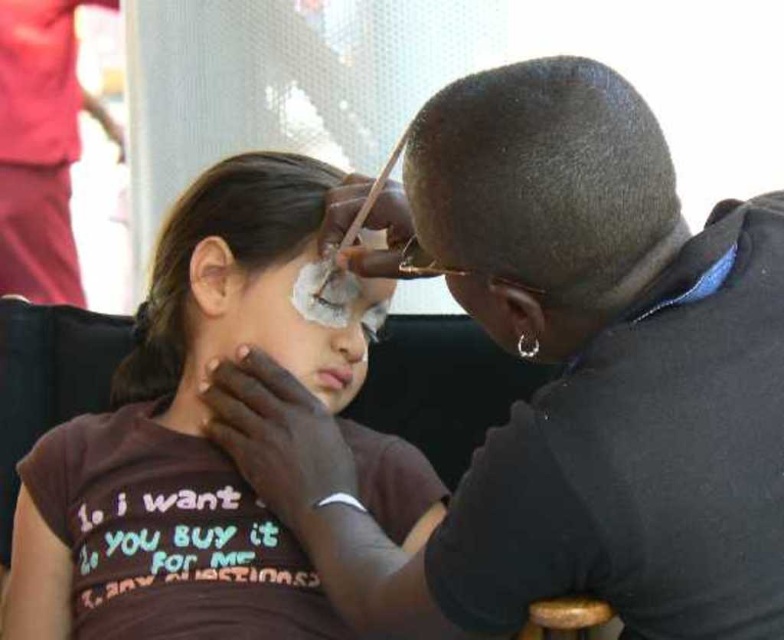
Question: Can you confirm if smooth skin face paint at upper center is positioned below matte black face at upper center?

Choices:
 (A) yes
 (B) no

Answer: (A)

Question: Does matte brown shirt at center have a larger size compared to white matte face paint at center?

Choices:
 (A) no
 (B) yes

Answer: (B)

Question: Which object is farther from the camera taking this photo?

Choices:
 (A) smooth skin face paint at upper center
 (B) matte brown shirt at center
 (C) white matte face paint at center
 (D) matte black face at upper center

Answer: (C)

Question: Which is farther from the smooth skin face paint at upper center?

Choices:
 (A) white matte face paint at center
 (B) matte brown shirt at center

Answer: (A)

Question: Does smooth skin face paint at upper center appear over matte brown shirt at center?

Choices:
 (A) yes
 (B) no

Answer: (A)

Question: Among these points, which one is farthest from the camera?

Choices:
 (A) (416, 268)
 (B) (191, 186)
 (C) (753, 492)

Answer: (B)